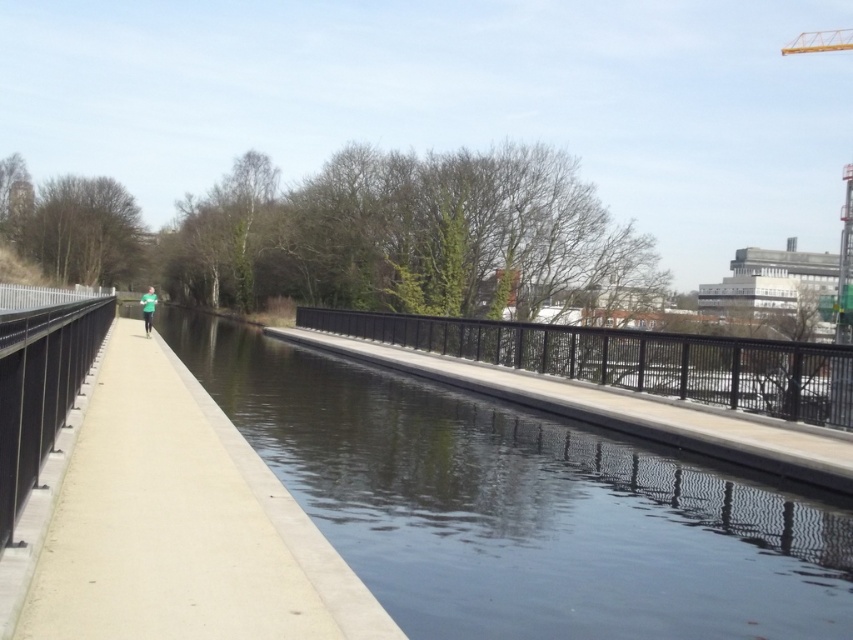
Between smooth concrete river at center and black metal rail at center, which one is positioned lower?

Positioned lower is smooth concrete river at center.

What do you see at coordinates (521, 506) in the screenshot? The image size is (853, 640). I see `smooth concrete river at center` at bounding box center [521, 506].

Identify the location of smooth concrete river at center. (521, 506).

Who is more forward, (610, 513) or (160, 588)?

Positioned in front is point (160, 588).

Which is below, smooth concrete river at center or concrete sidewalk at center?

smooth concrete river at center

Does point (466, 636) come farther from viewer compared to point (152, 589)?

Yes, it is behind point (152, 589).

At what (x,y) coordinates should I click in order to perform the action: click on smooth concrete river at center. Please return your answer as a coordinate pair (x, y). This screenshot has width=853, height=640. Looking at the image, I should click on (521, 506).

Who is positioned more to the left, concrete sidewalk at center or black metal rail at center?

Positioned to the left is concrete sidewalk at center.

Is concrete sidewalk at center smaller than black metal rail at center?

Indeed, concrete sidewalk at center has a smaller size compared to black metal rail at center.

The height and width of the screenshot is (640, 853). Identify the location of concrete sidewalk at center. (178, 524).